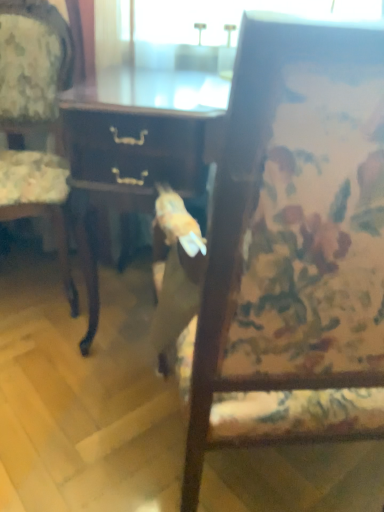
Image resolution: width=384 pixels, height=512 pixels. In order to click on vacant area that is in front of wooden floral-patterned chair at left, which appears as the 1th chair when viewed from the left in this screenshot , I will do `click(43, 357)`.